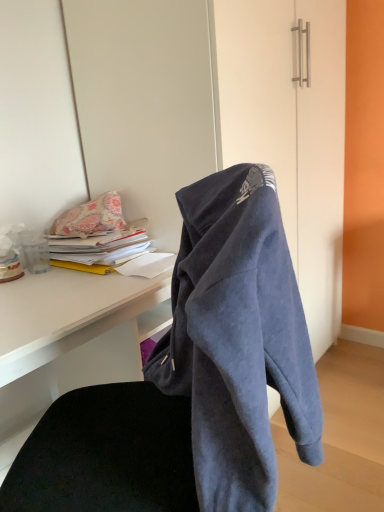
Question: Does dark blue fleece hoodie at center have a greater height compared to floral fabric pillow at upper left?

Choices:
 (A) no
 (B) yes

Answer: (B)

Question: Considering the relative positions of dark blue fleece hoodie at center and floral fabric pillow at upper left in the image provided, is dark blue fleece hoodie at center behind floral fabric pillow at upper left?

Choices:
 (A) yes
 (B) no

Answer: (B)

Question: Does dark blue fleece hoodie at center have a lesser width compared to floral fabric pillow at upper left?

Choices:
 (A) yes
 (B) no

Answer: (B)

Question: Is dark blue fleece hoodie at center far away from floral fabric pillow at upper left?

Choices:
 (A) no
 (B) yes

Answer: (A)

Question: Is dark blue fleece hoodie at center positioned beyond the bounds of floral fabric pillow at upper left?

Choices:
 (A) no
 (B) yes

Answer: (B)

Question: From the image's perspective, is yellow paper at left located above or below matte white desk at center?

Choices:
 (A) below
 (B) above

Answer: (B)

Question: From a real-world perspective, is yellow paper at left above or below matte white desk at center?

Choices:
 (A) below
 (B) above

Answer: (B)

Question: Is yellow paper at left inside the boundaries of matte white desk at center, or outside?

Choices:
 (A) outside
 (B) inside

Answer: (A)

Question: From their relative heights in the image, would you say yellow paper at left is taller or shorter than matte white desk at center?

Choices:
 (A) short
 (B) tall

Answer: (A)

Question: Based on their sizes in the image, would you say matte white desk at center is bigger or smaller than floral fabric pillow at upper left?

Choices:
 (A) big
 (B) small

Answer: (A)

Question: Is matte white desk at center inside or outside of floral fabric pillow at upper left?

Choices:
 (A) outside
 (B) inside

Answer: (A)

Question: Is matte white desk at center to the left or to the right of floral fabric pillow at upper left in the image?

Choices:
 (A) right
 (B) left

Answer: (A)

Question: Is point (49, 403) closer or farther from the camera than point (115, 219)?

Choices:
 (A) closer
 (B) farther

Answer: (B)

Question: Considering the positions of yellow paper at left and floral fabric pillow at upper left in the image, is yellow paper at left bigger or smaller than floral fabric pillow at upper left?

Choices:
 (A) big
 (B) small

Answer: (A)

Question: From a real-world perspective, is yellow paper at left physically located above or below floral fabric pillow at upper left?

Choices:
 (A) above
 (B) below

Answer: (B)